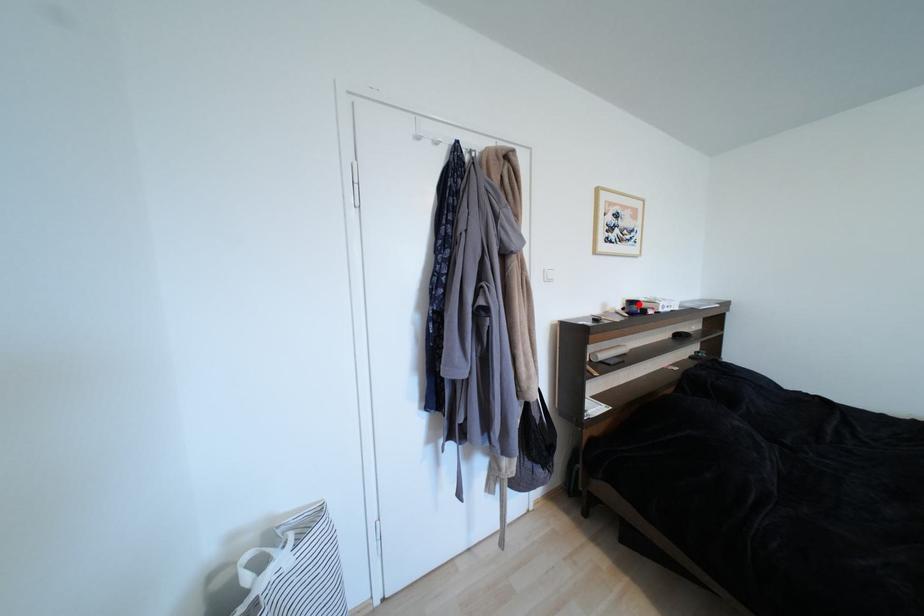
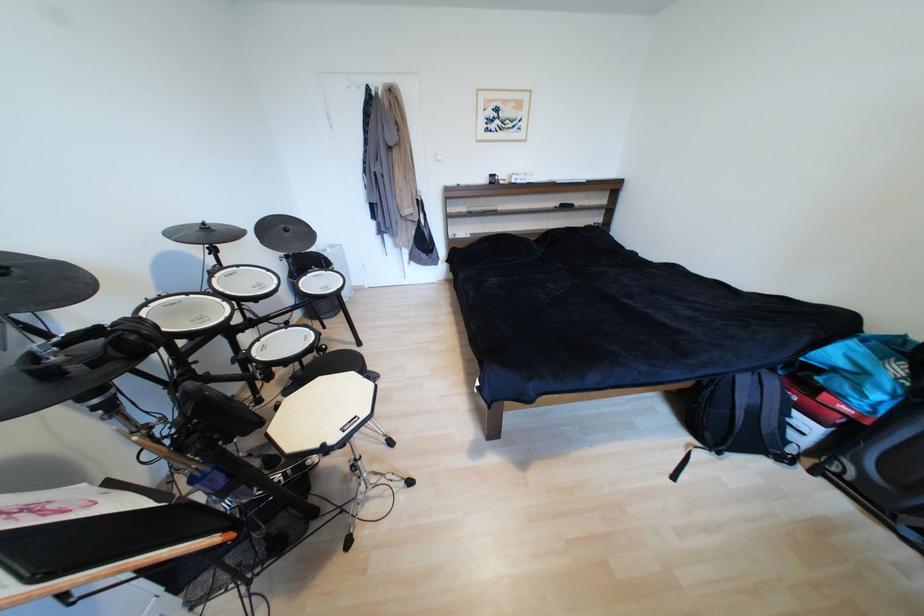
In the second image, find the point that corresponds to the highlighted location in the first image.

(499, 177)